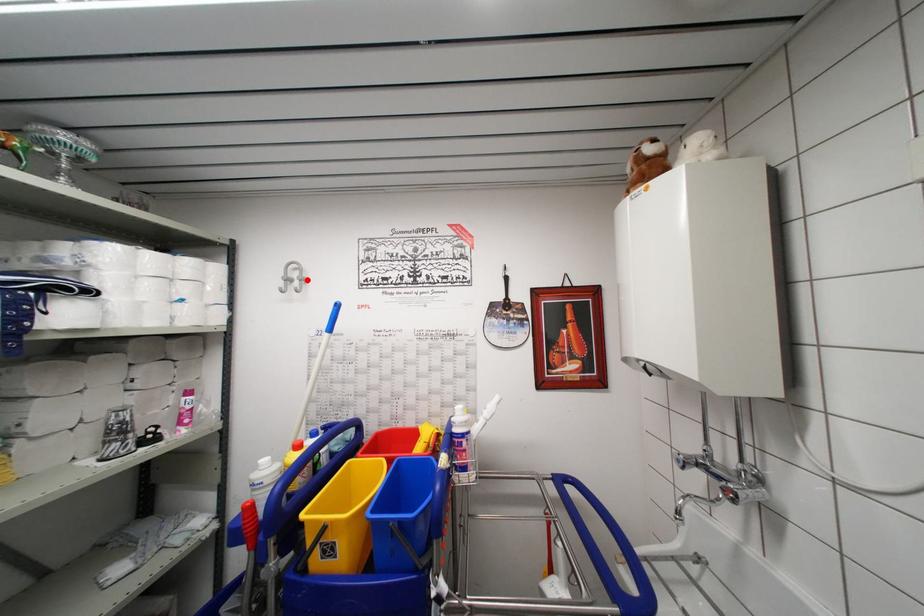
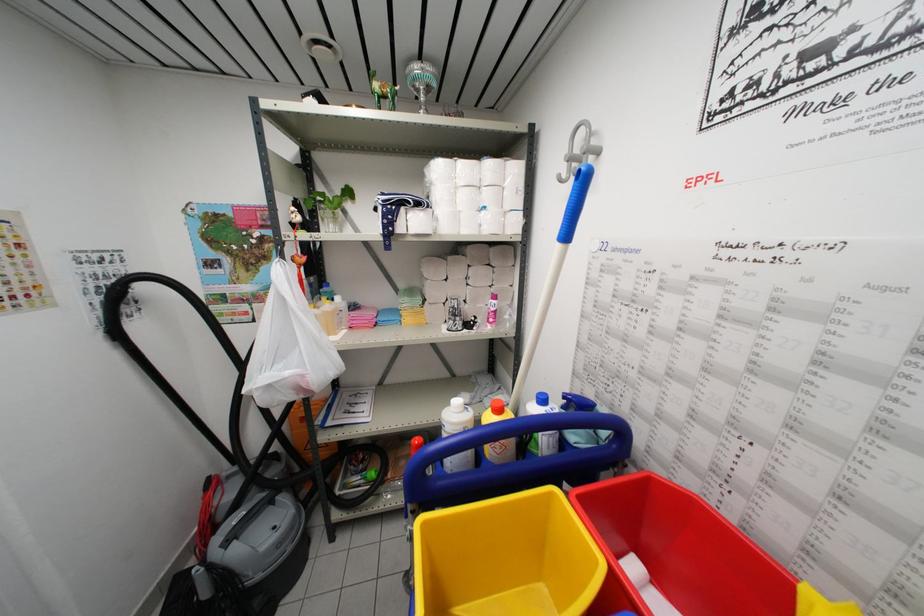
Find the pixel in the second image that matches the highlighted location in the first image.

(597, 148)